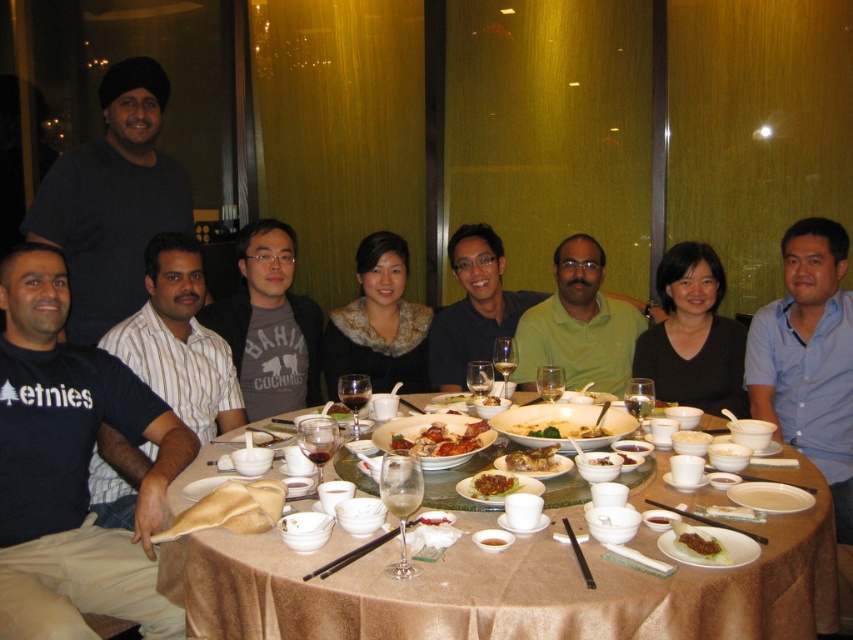
Question: Which point is closer to the camera?

Choices:
 (A) brown crispy chicken at center
 (B) blue shirt at center

Answer: (A)

Question: Which point is farther to the camera?

Choices:
 (A) fur-trimmed black coat at center
 (B) golden brown fried chicken at center

Answer: (A)

Question: Can you confirm if black matte shirt at center is thinner than golden brown fried chicken at center?

Choices:
 (A) yes
 (B) no

Answer: (B)

Question: Considering the relative positions of black cotton t-shirt at left and white matte platter at lower right in the image provided, where is black cotton t-shirt at left located with respect to white matte platter at lower right?

Choices:
 (A) above
 (B) below

Answer: (A)

Question: Is white porcelain bowl at center below brown glossy bowl at center?

Choices:
 (A) yes
 (B) no

Answer: (A)

Question: Which point appears farthest from the camera in this image?

Choices:
 (A) pos(708,451)
 (B) pos(698,442)

Answer: (B)